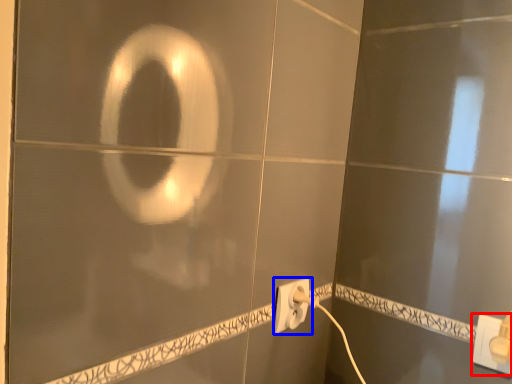
Question: Which point is closer to the camera, power plugs and sockets (highlighted by a red box) or power plugs and sockets (highlighted by a blue box)?

Choices:
 (A) power plugs and sockets
 (B) power plugs and sockets

Answer: (A)